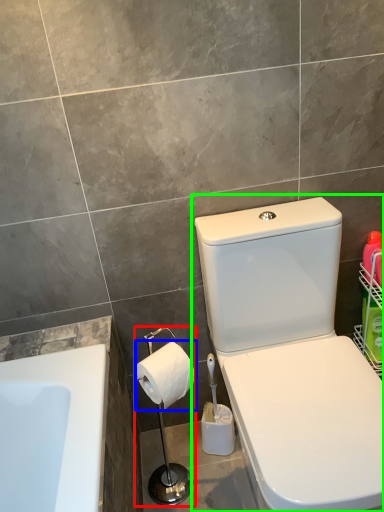
Question: Which object is the closest to the shower (highlighted by a red box)? Choose among these: toilet paper (highlighted by a blue box) or toilet (highlighted by a green box).

Choices:
 (A) toilet paper
 (B) toilet

Answer: (A)